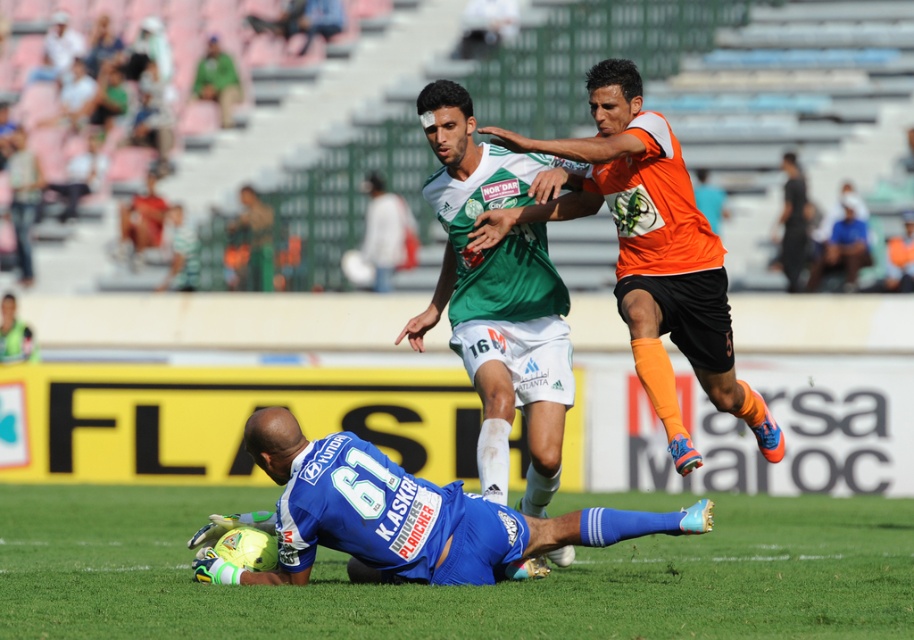
In the scene shown: You are a sports analyst watching the soccer match. You notice two jerseys in the image, the green jersey at center and the blue jersey at lower center. Which jersey appears bigger in the picture?

The green jersey at center appears larger than the blue jersey at lower center because it is described as larger in size.

You are a referee observing the soccer match. You need to determine if the green jersey at center is positioned to the right of the blue jersey at lower center. Based on the scene, what is your observation?

The green jersey at center is to the right of the blue jersey at lower center according to the description.